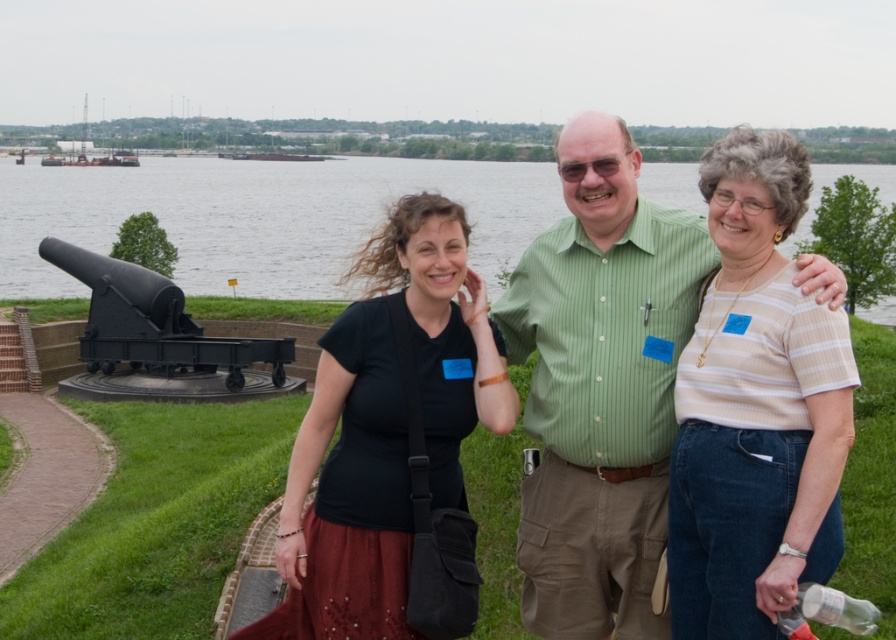
Question: Is black matte shirt at center smaller than black matte cannon at lower left?

Choices:
 (A) no
 (B) yes

Answer: (A)

Question: Is the position of striped cotton shirt at center less distant than that of black matte cannon at lower left?

Choices:
 (A) yes
 (B) no

Answer: (A)

Question: Is striped cotton shirt at center smaller than green striped shirt at center?

Choices:
 (A) yes
 (B) no

Answer: (A)

Question: Which object is farther from the camera taking this photo?

Choices:
 (A) black matte cannon at lower left
 (B) green striped shirt at center
 (C) striped cotton shirt at center
 (D) black matte shirt at center

Answer: (A)

Question: Which object appears closest to the camera in this image?

Choices:
 (A) glossy water at center
 (B) black matte shirt at center
 (C) black matte cannon at lower left

Answer: (A)

Question: Estimate the real-world distances between objects in this image. Which object is farther from the striped cotton shirt at center?

Choices:
 (A) black matte cannon at lower left
 (B) glossy water at center
 (C) green striped shirt at center
 (D) black matte shirt at center

Answer: (B)